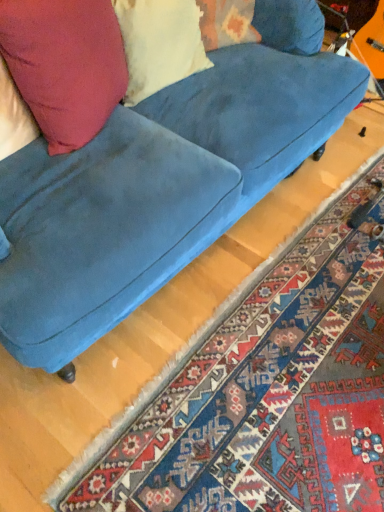
Question: From the image's perspective, is matte yellow pillow at upper left located above or below matte pink pillow at upper left?

Choices:
 (A) below
 (B) above

Answer: (B)

Question: Which is correct: matte yellow pillow at upper left is inside matte pink pillow at upper left, or outside of it?

Choices:
 (A) outside
 (B) inside

Answer: (A)

Question: Which is nearer to the matte pink pillow at upper left?

Choices:
 (A) velvet blue couch at center
 (B) carpet with intricate patterns at lower right
 (C) matte yellow pillow at upper left

Answer: (A)

Question: Based on their relative distances, which object is farther from the matte pink pillow at upper left?

Choices:
 (A) velvet blue couch at center
 (B) matte yellow pillow at upper left
 (C) carpet with intricate patterns at lower right

Answer: (C)